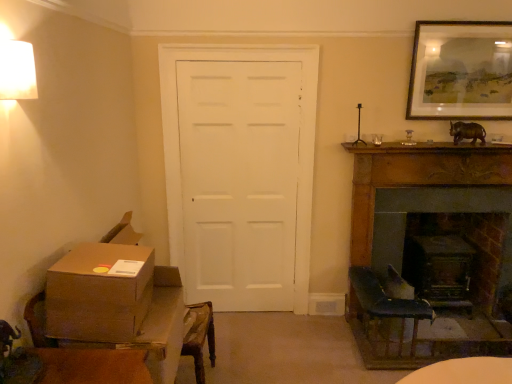
Identify the location of free space in front of white matte door at center. pos(252,349).